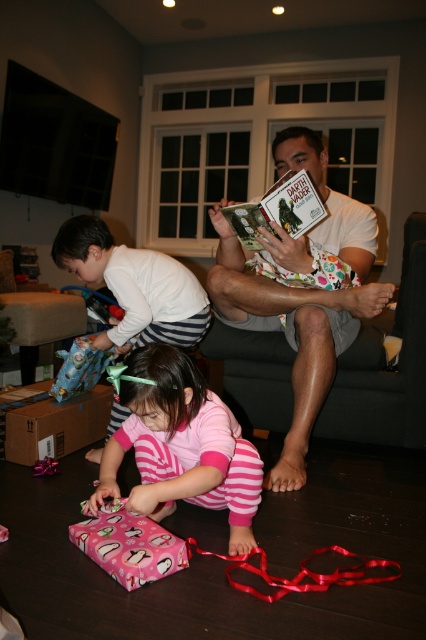
You are a photographer taking a picture of the gift and the ribbon in the scene. The gift is at point [164,428] and the ribbon is at point [123,573]. Which object is closer to the camera?

Point [164,428] is further to the camera than point [123,573]. Therefore, the gift at point [164,428] is closer to the camera than the ribbon at point [123,573].

You are a parent trying to place a small gift box between the white dotted shorts at center and the hardcover book at center. Can you fit it if the gift box is 7 inches long?

The white dotted shorts at center and hardcover book at center are 8.16 inches apart from each other. Since the gift box is 7 inches long, it can fit between them as the space is larger than the box.

You are a parent trying to organize the living room after the gift opening. You see the white striped pants at left and the pink glossy wrapping paper at lower left. Which item takes up more space in the room?

The white striped pants at left has a larger size compared to pink glossy wrapping paper at lower left, so it takes up more space in the room.